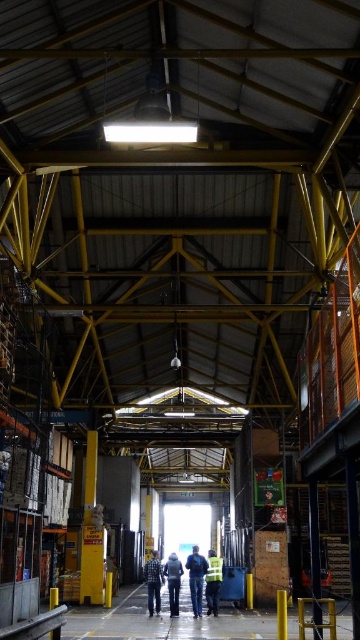
You are a warehouse worker who needs to place a stack of boxes on a shelf. You see the blue denim jeans at center and the denim jacket at center. Which item should you avoid placing the boxes on top of to prevent crushing the smaller one?

You should avoid placing the boxes on top of the denim jacket at center because it is smaller and shorter than the blue denim jeans at center, making it more vulnerable to being crushed.

You are an employee in the warehouse and need to retrieve an item. You see the blue denim jeans at center and the denim jacket at center. Which item is closer to the ground?

The blue denim jeans at center is positioned under the denim jacket at center, so it is closer to the ground.

You are a warehouse worker who needs to locate your personal items. You see a reflective yellow vest at center and a denim jacket at center. Which item is positioned more to the right?

The reflective yellow vest at center is positioned to the right of the denim jacket at center, so the reflective yellow vest at center is more to the right.